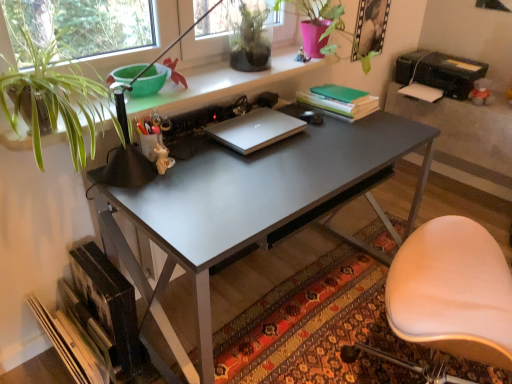
Find the location of `unoccupied space behind matte white figurine at center`. unoccupied space behind matte white figurine at center is located at coordinates (185, 151).